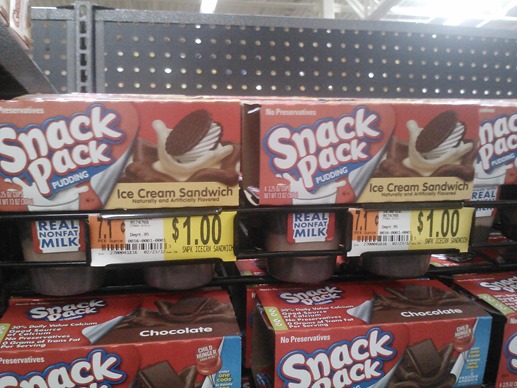
Image resolution: width=517 pixels, height=388 pixels. I want to click on top shelf, so click(x=343, y=152).